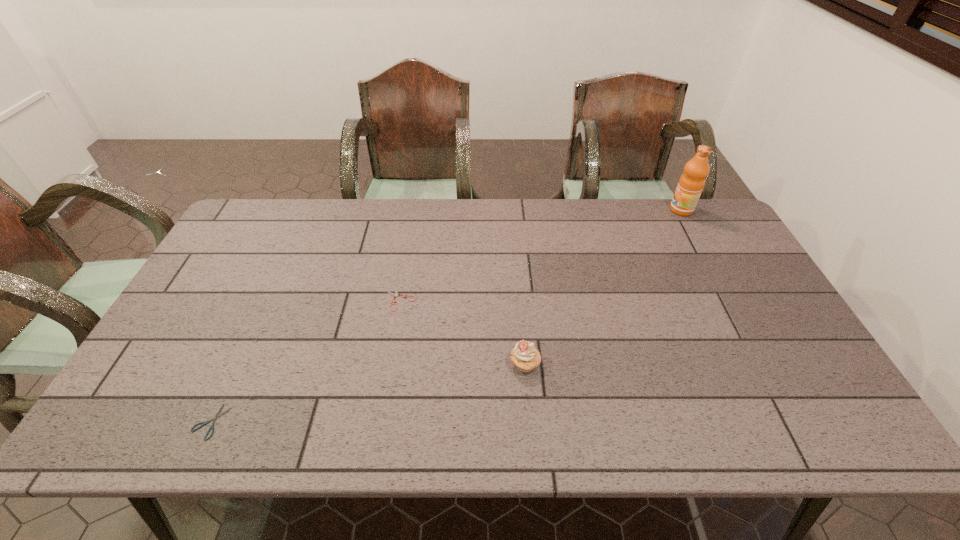
In the image, there is a desktop. In order to click on vacant space at the left edge in this screenshot , I will do `click(228, 272)`.

Identify the location of vacant area at the right edge of the desktop. The image size is (960, 540). (725, 310).

Locate an element on the screen. Image resolution: width=960 pixels, height=540 pixels. vacant space at the far left corner is located at coordinates pyautogui.click(x=253, y=218).

Identify the location of vacant space at the far right corner of the desktop. Image resolution: width=960 pixels, height=540 pixels. (718, 240).

You are a GUI agent. You are given a task and a screenshot of the screen. Output one action in this format:
    pyautogui.click(x=<x>, y=<y>)
    Task: Click on the free region at the near right corner of the desktop
    
    Given the screenshot: What is the action you would take?
    pyautogui.click(x=797, y=416)

This screenshot has width=960, height=540. I want to click on free spot between the farther shears and the rightmost object, so click(x=540, y=254).

Find the location of `free space between the right shears and the rightmost object`. free space between the right shears and the rightmost object is located at coordinates (540, 254).

Where is `vacant space in between the cupcake and the leftmost object`? Image resolution: width=960 pixels, height=540 pixels. vacant space in between the cupcake and the leftmost object is located at coordinates (368, 393).

Image resolution: width=960 pixels, height=540 pixels. Find the location of `vacant space that's between the nearer shears and the rightmost object`. vacant space that's between the nearer shears and the rightmost object is located at coordinates (446, 316).

Identify the location of free space that is in between the second nearest object and the nearer shears. (368, 393).